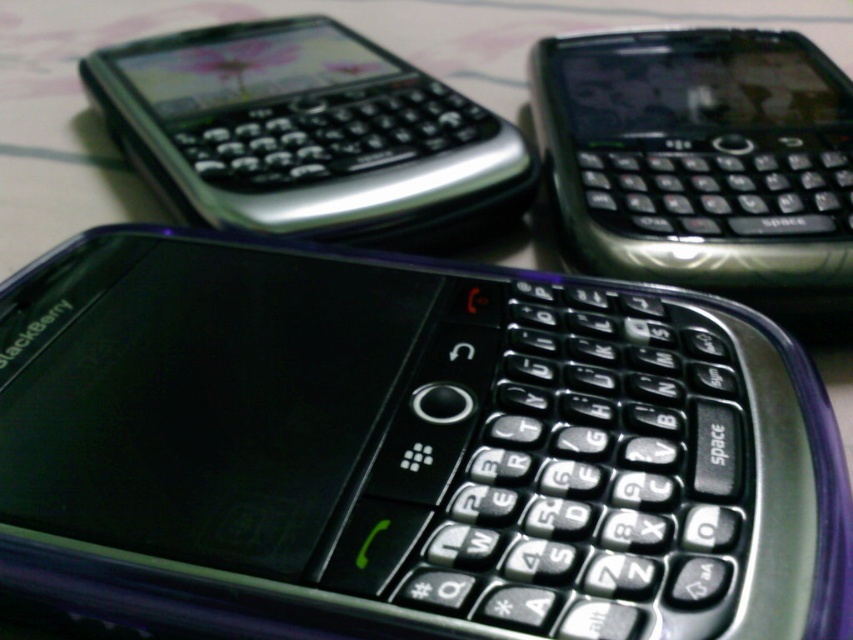
Between black glossy phone at upper right and satin silver phone at upper left, which one appears on the right side from the viewer's perspective?

Positioned to the right is black glossy phone at upper right.

Who is shorter, black glossy phone at upper right or satin silver phone at upper left?

Standing shorter between the two is black glossy phone at upper right.

Who is more distant from viewer, (796, 100) or (165, 104)?

The point (165, 104) is more distant.

Locate an element on the screen. The width and height of the screenshot is (853, 640). black glossy phone at upper right is located at coordinates (699, 156).